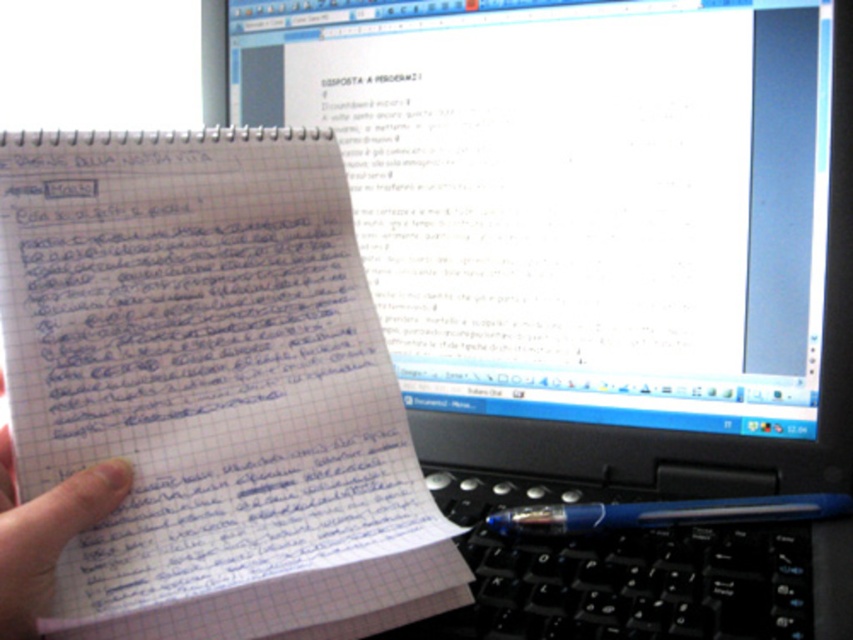
You are organizing a desk and need to place the black plastic keyboard at lower center and the blue plastic pen at bottom right. According to the scene, which object is located more to the left?

The black plastic keyboard at lower center is positioned more to the left than the blue plastic pen at bottom right.

You are setting up a desk and need to place the white glossy monitor at upper center and the black plastic keyboard at lower center. Given that the desk has limited space, which object should you prioritize placing first to ensure both fit properly?

You should prioritize placing the white glossy monitor at upper center first because it is larger than the black plastic keyboard at lower center, ensuring there is enough space for both.

You are a student who needs to write a note on the paper. You have a black plastic keyboard at lower center and a blue plastic pen at bottom right. Which object should you choose to write the note?

You should choose the blue plastic pen at bottom right because the black plastic keyboard at lower center is much taller and not suitable for writing on paper.